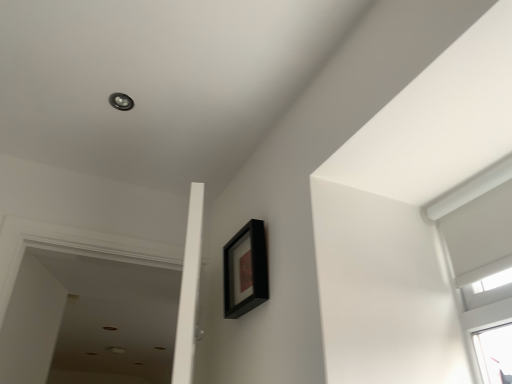
At what (x,y) coordinates should I click in order to perform the action: click on black matte picture frame at upper right. Please return your answer as a coordinate pair (x, y). This screenshot has width=512, height=384. Looking at the image, I should click on (245, 270).

Describe the element at coordinates (245, 270) in the screenshot. This screenshot has height=384, width=512. I see `black matte picture frame at upper right` at that location.

Find the location of a particular element. black matte picture frame at upper right is located at coordinates click(x=245, y=270).